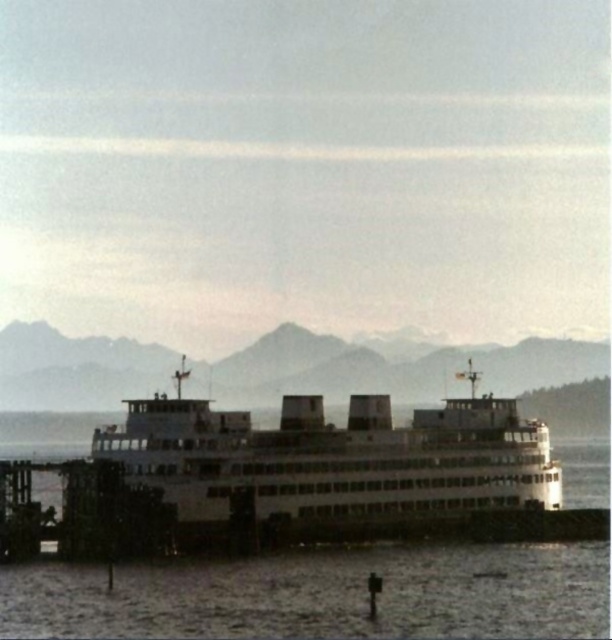
You are a passenger on the ferry and want to take a photo of the mountains in the background. Since the white matte ferry at center is blocking your view, can you step to the side to see the mountains through the white matte water at center?

The white matte water at center is behind the white matte ferry at center, so stepping to the side might allow you to see the mountains through the gap between the ferry and the water.

You are a photographer planning to capture the ferry and the water in a single shot. Given that the white matte ferry at center and the white matte water at center are both in the frame, which one will occupy a larger portion of the photo?

The white matte water at center will occupy a larger portion of the photo because the white matte ferry at center is smaller than the white matte water at center according to the description.

You are a photographer planning to capture the ferry and the water in the scene. Since you want to focus on the ferry, which object should you zoom in on more, the white matte ferry at center or the white matte water at center?

You should zoom in more on the white matte ferry at center because its width is smaller than the white matte water at center, allowing it to be more prominently featured in the photo.